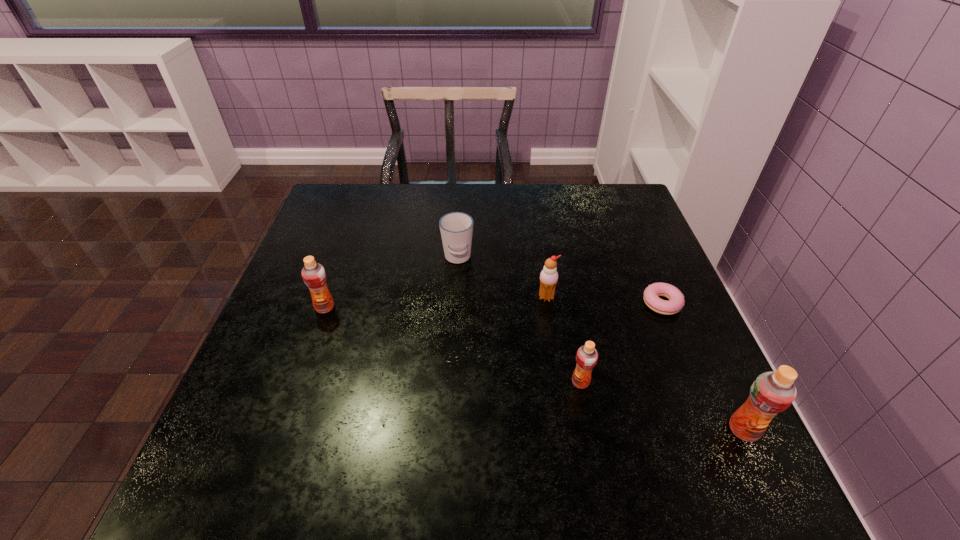
I want to click on empty space that is in between the tallest object and the second object from left to right, so click(x=601, y=344).

This screenshot has width=960, height=540. In order to click on blank region between the doughnut and the farthest object in this screenshot , I will do `click(560, 281)`.

Where is `vacant area that lies between the leftmost object and the shortest object`? This screenshot has width=960, height=540. vacant area that lies between the leftmost object and the shortest object is located at coordinates (493, 306).

Find the location of a particular element. free spot between the leftmost orange juice and the third object from left to right is located at coordinates (436, 302).

The width and height of the screenshot is (960, 540). I want to click on free spot between the farthest object and the third object from left to right, so click(502, 278).

You are a GUI agent. You are given a task and a screenshot of the screen. Output one action in this format:
    pyautogui.click(x=<x>, y=<y>)
    Task: Click on the vacant point located between the farthest object and the third object from right to left
    
    Given the screenshot: What is the action you would take?
    pyautogui.click(x=519, y=320)

Locate an element on the screen. free space between the shortest object and the fifth farthest object is located at coordinates (621, 343).

Where is `object that is the second closest to the third object from right to left`? Image resolution: width=960 pixels, height=540 pixels. object that is the second closest to the third object from right to left is located at coordinates (676, 302).

Image resolution: width=960 pixels, height=540 pixels. What are the coordinates of `the third closest object to the doughnut` in the screenshot? It's located at (771, 393).

Find the location of a particular element. The image size is (960, 540). orange juice that is the closest to the third object from left to right is located at coordinates (586, 357).